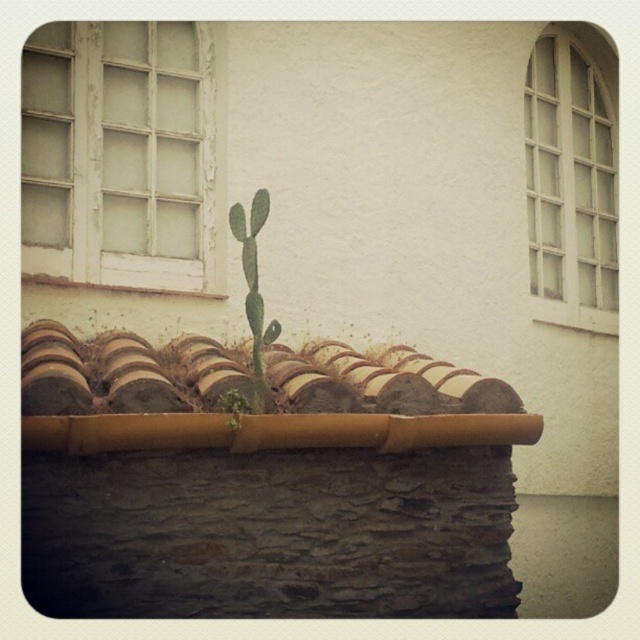
You are a painter standing on a ladder to paint the exterior wall. You need to reach both the brown clay tiles at center and the white wooden grid at upper right. Given that your ladder can only be placed once, and you can only move vertically, can you paint both areas without moving the ladder? Explain your reasoning.

The brown clay tiles at center and the white wooden grid at upper right are 7.45 feet apart from each other. Since the ladder can only be placed once and you can only move vertically, you would need to ensure that both areas are within the ladder height range. However, the distance between them is 7.45 feet, which likely exceeds the typical ladder height adjustment capability, so you would need to move the ladder to reach both areas.

Consider the image. You are an architect designing a new building facade. You need to ensure that the brown clay tiles at center and the white wooden grid at upper right are placed in a way that maintains visual balance. Given their sizes, which object should be positioned closer to the center of the facade to achieve this balance?

The brown clay tiles at center, which are wider than the white wooden grid at upper right, should be positioned closer to the center of the facade to balance their larger size with their central placement.

You are standing in front of the building and notice the white wooden window at upper left and the green spiny cactus at center. Which object is positioned higher up on the wall?

The white wooden window at upper left is positioned higher up on the wall than the green spiny cactus at center because the description states it is above the cactus.